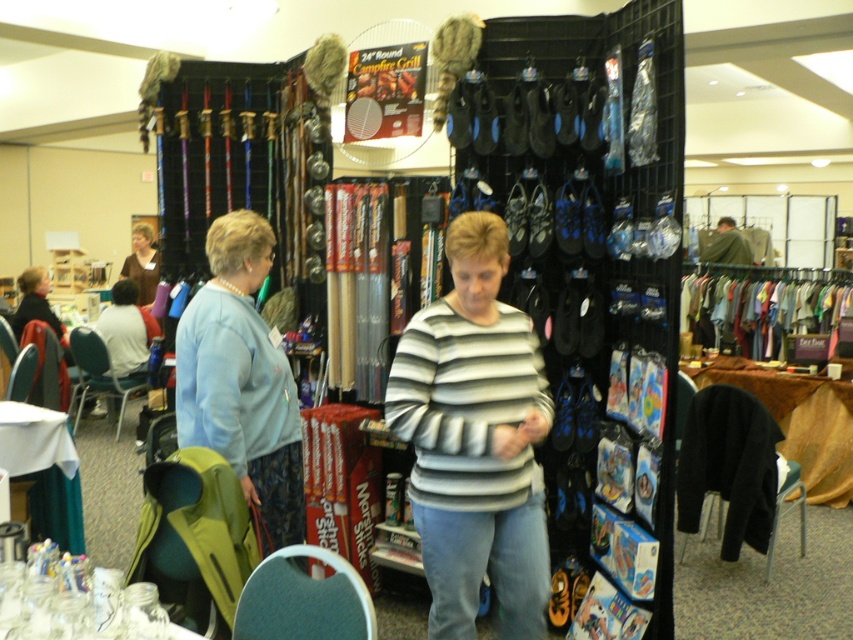
Does light blue sweater at center appear on the left side of white cotton shirt at left?

No, light blue sweater at center is not to the left of white cotton shirt at left.

Is point (260, 499) closer to viewer compared to point (120, 292)?

Yes, point (260, 499) is in front of point (120, 292).

Where is `light blue sweater at center`? The width and height of the screenshot is (853, 640). light blue sweater at center is located at coordinates (241, 380).

Is striped cotton sweater at center wider than green fabric jacket at center?

In fact, striped cotton sweater at center might be narrower than green fabric jacket at center.

Measure the distance from striped cotton sweater at center to green fabric jacket at center.

They are 5.47 meters apart.

Does point (489, 275) lie in front of point (747, 250)?

That is True.

I want to click on striped cotton sweater at center, so click(474, 440).

Which is behind, point (447, 349) or point (260, 336)?

Positioned behind is point (260, 336).

Does striped cotton sweater at center appear on the left side of light blue sweater at center?

Incorrect, striped cotton sweater at center is not on the left side of light blue sweater at center.

The height and width of the screenshot is (640, 853). Identify the location of striped cotton sweater at center. (474, 440).